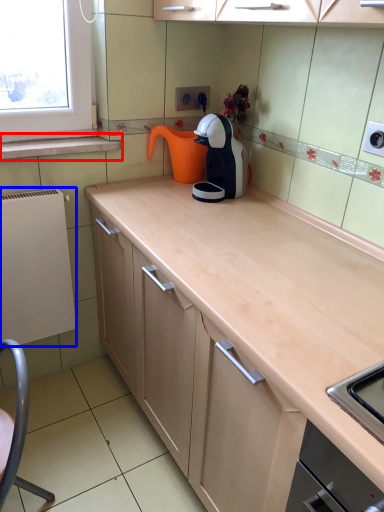
Question: Which object is closer to the camera taking this photo, window sill (highlighted by a red box) or appliance (highlighted by a blue box)?

Choices:
 (A) window sill
 (B) appliance

Answer: (B)